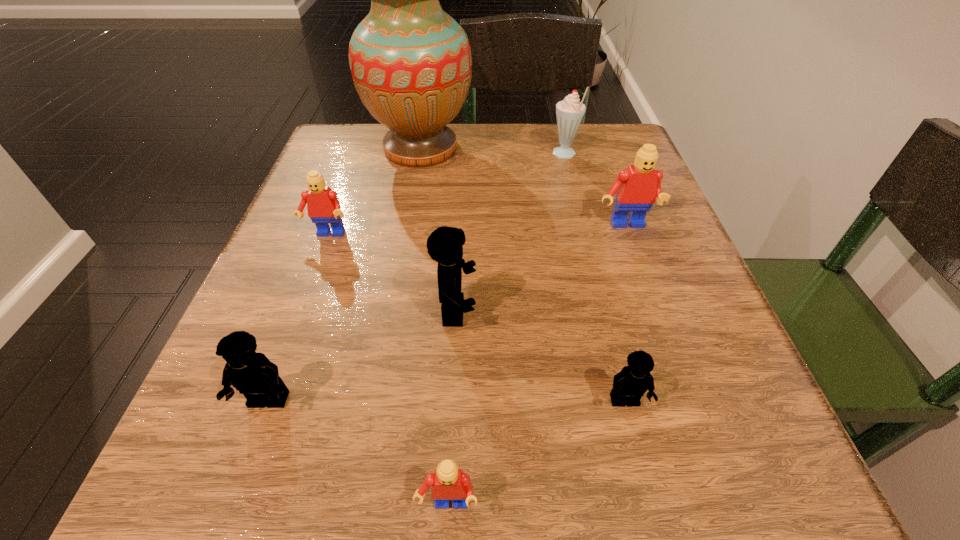
This screenshot has height=540, width=960. What are the coordinates of `vacant area situated 0.060m on the front of the tallest object` in the screenshot? It's located at (412, 195).

Locate an element on the screen. vacant region located 0.090m on the straw side of the milkshake is located at coordinates (509, 156).

This screenshot has width=960, height=540. I want to click on free space located on the straw side of the milkshake, so click(499, 156).

Identify the location of vacant region located on the straw side of the milkshake. The width and height of the screenshot is (960, 540). (381, 156).

The image size is (960, 540). Identify the location of vacant space located 0.150m on the front-facing side of the farthest yellow Lego. (580, 312).

Locate an element on the screen. The height and width of the screenshot is (540, 960). blank area located on the front-facing side of the rightmost red Lego is located at coordinates (672, 360).

Locate an element on the screen. This screenshot has width=960, height=540. vacant region located on the front-facing side of the leftmost red Lego is located at coordinates (269, 394).

Where is `vacant space located on the front-facing side of the leftmost yellow Lego`? The image size is (960, 540). vacant space located on the front-facing side of the leftmost yellow Lego is located at coordinates (246, 462).

Where is `vacant area situated on the front-facing side of the rightmost yellow Lego`? This screenshot has height=540, width=960. vacant area situated on the front-facing side of the rightmost yellow Lego is located at coordinates (641, 467).

Find the location of a particular element. vase situated at the far edge is located at coordinates (411, 64).